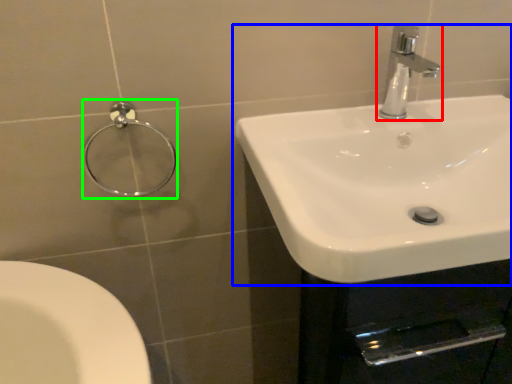
Question: Estimate the real-world distances between objects in this image. Which object is closer to tap (highlighted by a red box), sink (highlighted by a blue box) or shower (highlighted by a green box)?

Choices:
 (A) sink
 (B) shower

Answer: (A)